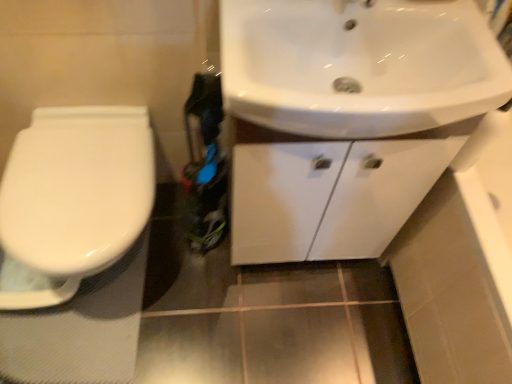
Question: Is white glossy sink at upper right facing towards white glossy cabinet at upper right?

Choices:
 (A) no
 (B) yes

Answer: (A)

Question: Is white glossy sink at upper right facing away from white glossy cabinet at upper right?

Choices:
 (A) no
 (B) yes

Answer: (A)

Question: Is white glossy sink at upper right thinner than white glossy cabinet at upper right?

Choices:
 (A) no
 (B) yes

Answer: (A)

Question: Does white glossy sink at upper right have a larger size compared to white glossy cabinet at upper right?

Choices:
 (A) no
 (B) yes

Answer: (A)

Question: From a real-world perspective, is white glossy sink at upper right positioned under white glossy cabinet at upper right based on gravity?

Choices:
 (A) no
 (B) yes

Answer: (A)

Question: From the image's perspective, is white glossy sink at upper right below white glossy cabinet at upper right?

Choices:
 (A) yes
 (B) no

Answer: (B)

Question: Is the depth of white glossy cabinet at upper right greater than that of white glossy toilet at left?

Choices:
 (A) yes
 (B) no

Answer: (B)

Question: Is white glossy cabinet at upper right at the left side of white glossy toilet at left?

Choices:
 (A) no
 (B) yes

Answer: (A)

Question: Is white glossy cabinet at upper right not near white glossy toilet at left?

Choices:
 (A) no
 (B) yes

Answer: (A)

Question: Is white glossy cabinet at upper right positioned with its back to white glossy toilet at left?

Choices:
 (A) yes
 (B) no

Answer: (B)

Question: Is white glossy cabinet at upper right surrounding white glossy toilet at left?

Choices:
 (A) yes
 (B) no

Answer: (B)

Question: Considering the relative sizes of white glossy cabinet at upper right and white glossy toilet at left in the image provided, is white glossy cabinet at upper right shorter than white glossy toilet at left?

Choices:
 (A) no
 (B) yes

Answer: (A)

Question: Can you confirm if white glossy toilet at left is positioned to the left of white glossy sink at upper right?

Choices:
 (A) yes
 (B) no

Answer: (A)